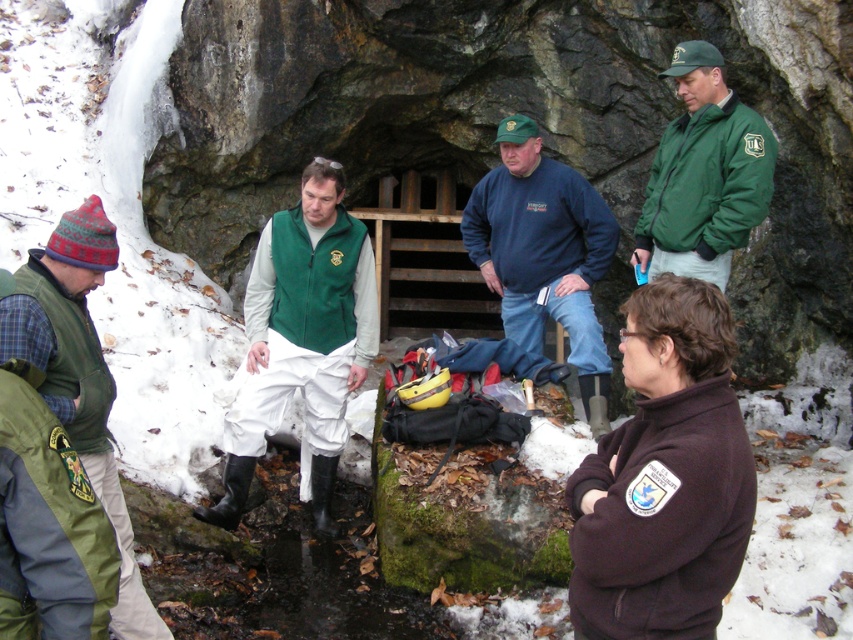
Between green fleece vest at left and green fleece vest at center, which one is positioned higher?

green fleece vest at center is above.

Is green fleece vest at left closer to the viewer compared to green fleece vest at center?

That is True.

Locate an element on the screen. green fleece vest at left is located at coordinates (78, 374).

Describe the element at coordinates (302, 339) in the screenshot. I see `green matte vest at center` at that location.

The height and width of the screenshot is (640, 853). What are the coordinates of `green matte vest at center` in the screenshot? It's located at (302, 339).

Is green fleece jacket at upper right to the right of green fleece vest at center from the viewer's perspective?

Indeed, green fleece jacket at upper right is positioned on the right side of green fleece vest at center.

The width and height of the screenshot is (853, 640). Describe the element at coordinates (704, 173) in the screenshot. I see `green fleece jacket at upper right` at that location.

Which is behind, point (718, 131) or point (364, 253)?

Point (364, 253)

Where is `green fleece jacket at upper right`? The image size is (853, 640). green fleece jacket at upper right is located at coordinates (704, 173).